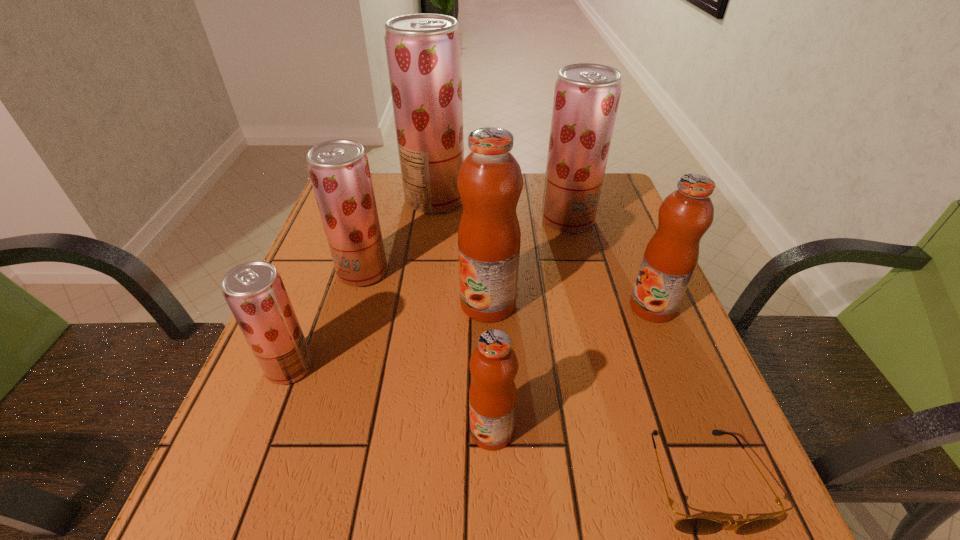
The image size is (960, 540). In order to click on empty space between the sunglasses and the third farthest strawberry fruit juice in this screenshot , I will do `click(532, 376)`.

Select which object is the third closest to the nearest fruit juice. Please provide its 2D coordinates. Your answer should be formatted as a tuple, i.e. [(x, y)], where the tuple contains the x and y coordinates of a point satisfying the conditions above.

[(254, 291)]

Locate an element on the screen. Image resolution: width=960 pixels, height=540 pixels. object that is the closest to the third biggest strawberry fruit juice is located at coordinates tap(254, 291).

Locate which fruit juice ranks fifth in proximity to the nearest strawberry fruit juice. Please provide its 2D coordinates. Your answer should be formatted as a tuple, i.e. [(x, y)], where the tuple contains the x and y coordinates of a point satisfying the conditions above.

[(586, 98)]

Image resolution: width=960 pixels, height=540 pixels. I want to click on fruit juice that is the third closest to the second smallest strawberry fruit juice, so click(490, 182).

Image resolution: width=960 pixels, height=540 pixels. Identify the location of strawberry fruit juice that can be found as the third closest to the sixth farthest object. (586, 98).

Where is `the fourth closest strawberry fruit juice relative to the rightmost orange fruit juice`? This screenshot has width=960, height=540. the fourth closest strawberry fruit juice relative to the rightmost orange fruit juice is located at coordinates (254, 291).

Identify which orange fruit juice is the nearest to the biggest orange fruit juice. Please provide its 2D coordinates. Your answer should be formatted as a tuple, i.e. [(x, y)], where the tuple contains the x and y coordinates of a point satisfying the conditions above.

[(493, 364)]

Select which orange fruit juice is the third closest to the second smallest strawberry fruit juice. Please provide its 2D coordinates. Your answer should be formatted as a tuple, i.e. [(x, y)], where the tuple contains the x and y coordinates of a point satisfying the conditions above.

[(671, 255)]